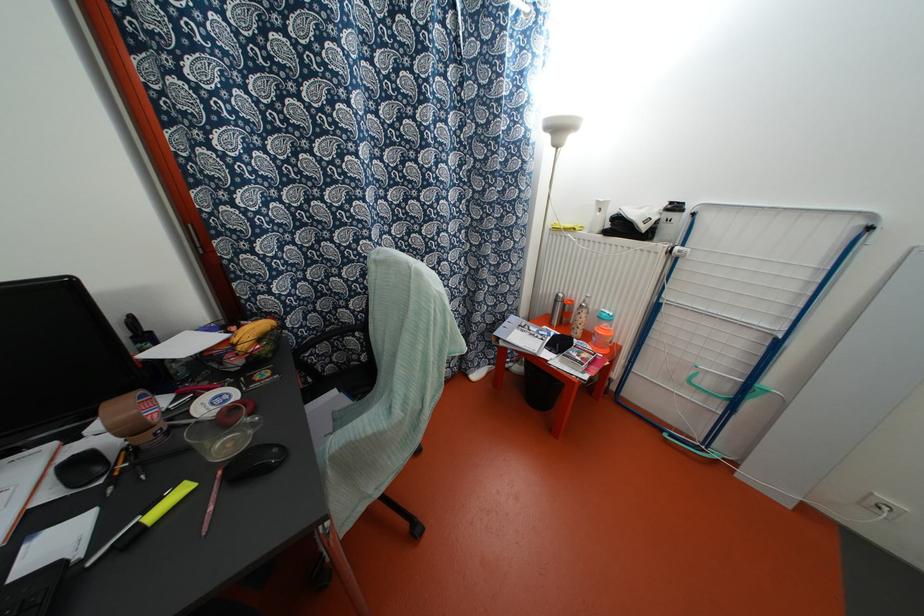
Where is `yellow banana`? yellow banana is located at coordinates (251, 333).